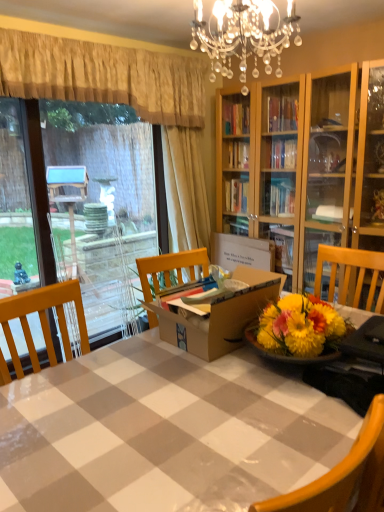
Question: Is cardboard box at center far from wooden chair at lower right?

Choices:
 (A) no
 (B) yes

Answer: (B)

Question: Considering the relative sizes of cardboard box at center and wooden chair at lower right in the image provided, is cardboard box at center thinner than wooden chair at lower right?

Choices:
 (A) no
 (B) yes

Answer: (B)

Question: Considering the relative positions of cardboard box at center and wooden chair at lower right in the image provided, is cardboard box at center to the right of wooden chair at lower right from the viewer's perspective?

Choices:
 (A) yes
 (B) no

Answer: (B)

Question: Does cardboard box at center lie in front of wooden chair at lower right?

Choices:
 (A) no
 (B) yes

Answer: (A)

Question: From a real-world perspective, is cardboard box at center under wooden chair at lower right?

Choices:
 (A) no
 (B) yes

Answer: (A)

Question: From a real-world perspective, is cardboard box at center positioned over wooden chair at lower right based on gravity?

Choices:
 (A) yes
 (B) no

Answer: (A)

Question: Can you confirm if transparent glass door at left is taller than cardboard box at center?

Choices:
 (A) no
 (B) yes

Answer: (B)

Question: Could you tell me if transparent glass door at left is turned towards cardboard box at center?

Choices:
 (A) no
 (B) yes

Answer: (B)

Question: Are transparent glass door at left and cardboard box at center located far from each other?

Choices:
 (A) yes
 (B) no

Answer: (B)

Question: Is transparent glass door at left closer to camera compared to cardboard box at center?

Choices:
 (A) yes
 (B) no

Answer: (A)

Question: Considering the relative sizes of transparent glass door at left and cardboard box at center in the image provided, is transparent glass door at left smaller than cardboard box at center?

Choices:
 (A) yes
 (B) no

Answer: (B)

Question: Is transparent glass door at left oriented away from cardboard box at center?

Choices:
 (A) no
 (B) yes

Answer: (A)

Question: From the image's perspective, would you say yellow textured curtain at upper left, arranged as the 2th curtain when viewed from the right, is positioned over beige fabric curtain at upper left, which ranks as the 1th curtain in right-to-left order?

Choices:
 (A) yes
 (B) no

Answer: (A)